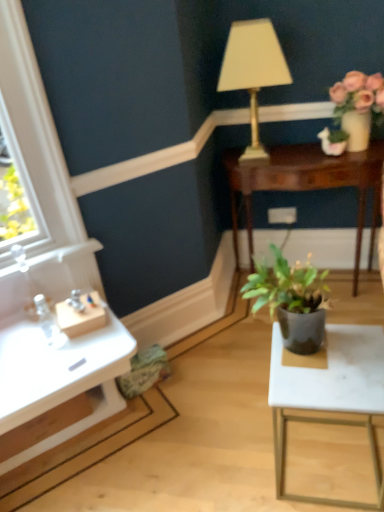
Locate an element on the screen. Image resolution: width=384 pixels, height=512 pixels. free space to the left of white marble table at lower right, which ranks as the first table in front-to-back order is located at coordinates (225, 458).